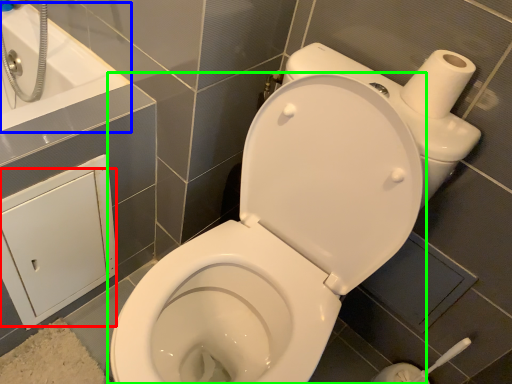
Question: Which is farther away from screen door (highlighted by a red box)? bath (highlighted by a blue box) or toilet (highlighted by a green box)?

Choices:
 (A) bath
 (B) toilet

Answer: (B)